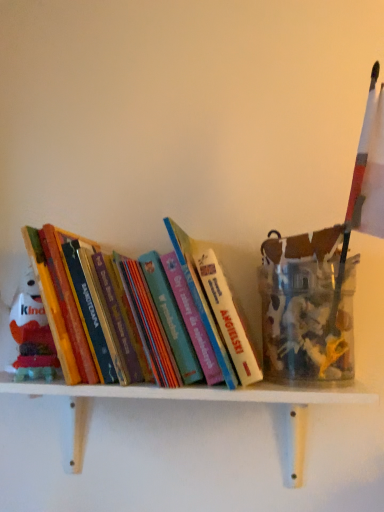
Question: Is point (x=173, y=398) positioned closer to the camera than point (x=246, y=330)?

Choices:
 (A) farther
 (B) closer

Answer: (B)

Question: From a real-world perspective, relative to hardcover books at center, is white wooden shelf at center vertically above or below?

Choices:
 (A) above
 (B) below

Answer: (B)

Question: Is white wooden shelf at center inside or outside of hardcover books at center?

Choices:
 (A) outside
 (B) inside

Answer: (A)

Question: Looking at the image, does hardcover books at center seem bigger or smaller compared to white wooden shelf at center?

Choices:
 (A) small
 (B) big

Answer: (A)

Question: Which is correct: hardcover books at center is inside white wooden shelf at center, or outside of it?

Choices:
 (A) outside
 (B) inside

Answer: (A)

Question: Does point (104, 373) appear closer or farther from the camera than point (304, 437)?

Choices:
 (A) farther
 (B) closer

Answer: (B)

Question: From the image's perspective, is hardcover books at center located above or below white wooden shelf at center?

Choices:
 (A) below
 (B) above

Answer: (B)